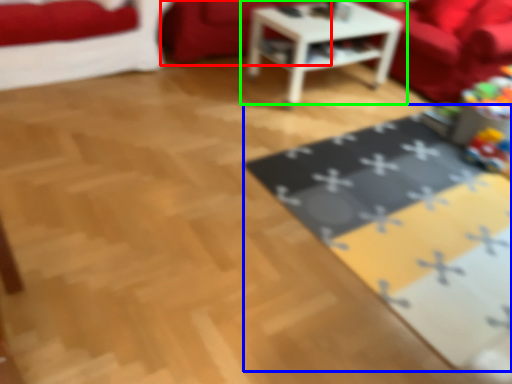
Question: Considering the real-world distances, which object is farthest from couch (highlighted by a red box)? mat (highlighted by a blue box) or table (highlighted by a green box)?

Choices:
 (A) mat
 (B) table

Answer: (A)